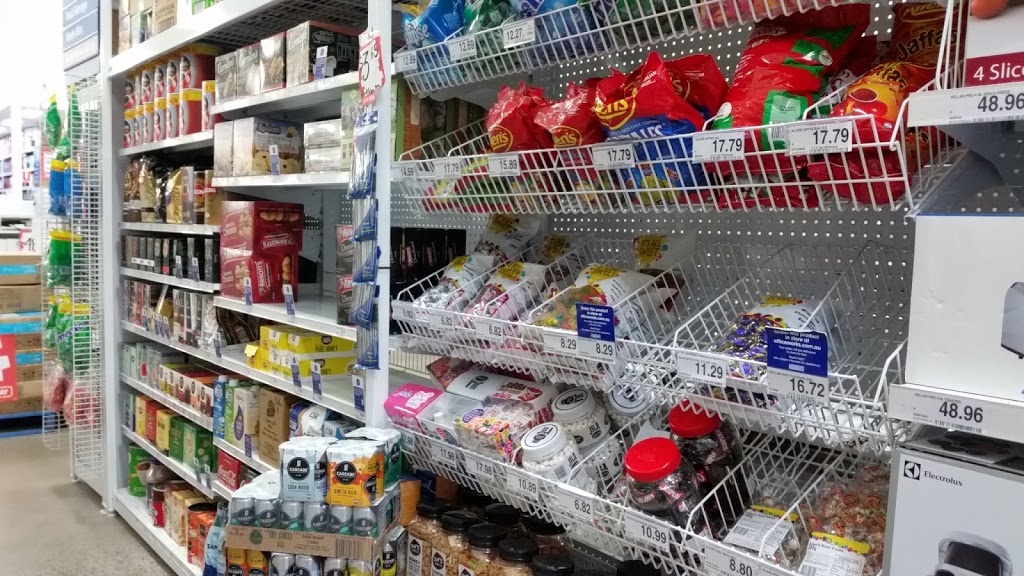
You are a GUI agent. You are given a task and a screenshot of the screen. Output one action in this format:
    pyautogui.click(x=<x>, y=<y>)
    Task: Click on the shelf feet
    This screenshot has width=1024, height=576.
    Given the screenshot: What is the action you would take?
    pyautogui.click(x=76, y=473), pyautogui.click(x=102, y=504)